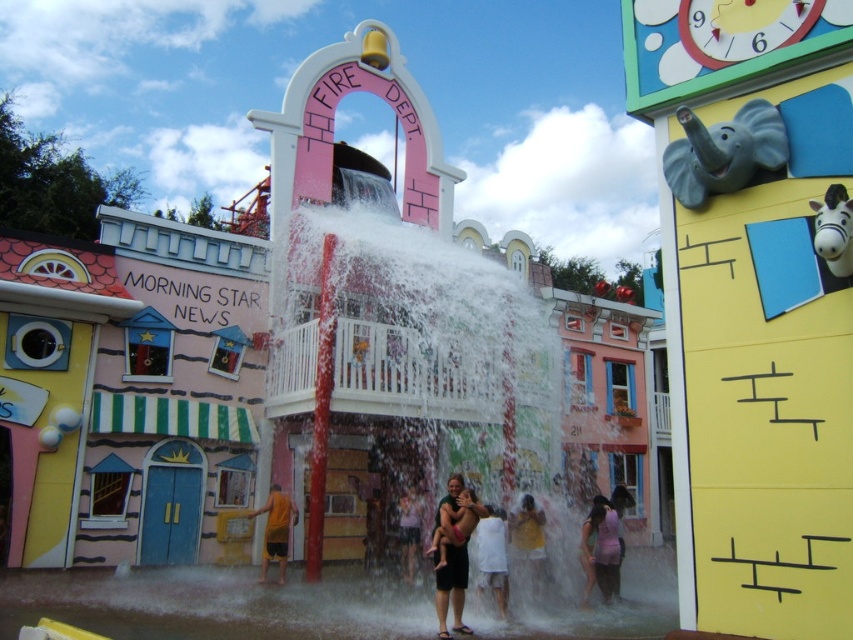
You are a visitor at the theme park and want to check the time on the matte yellow clock at upper right before heading to the pink fabric dress at lower center. Which object is wider?

The pink fabric dress at lower center is wider than the matte yellow clock at upper right.

You are a photographer standing at the entrance of the theme park, and you want to take a picture of the matte black shorts at lower center and the yellow matte shirt at lower center. Based on their positions, which one should you focus on first to ensure both are in the frame?

The matte black shorts at lower center is above the yellow matte shirt at lower center, so you should focus on the matte black shorts at lower center first to ensure both are in the frame.